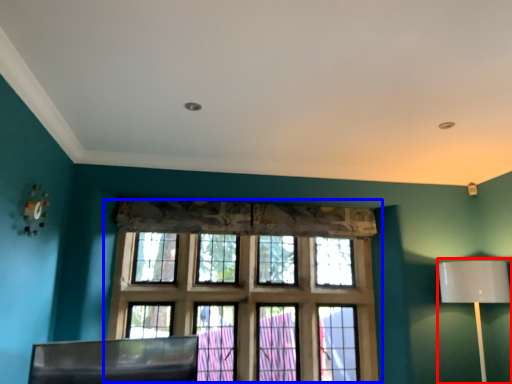
Question: Which object is closer to the camera taking this photo, table lamp (highlighted by a red box) or window (highlighted by a blue box)?

Choices:
 (A) table lamp
 (B) window

Answer: (A)